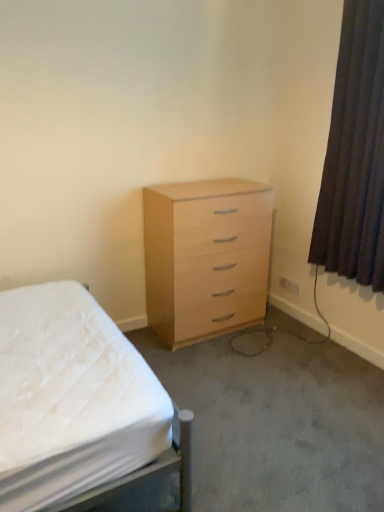
Where is `vacant area in front of light wood/veneer chest of drawers at center`? The height and width of the screenshot is (512, 384). vacant area in front of light wood/veneer chest of drawers at center is located at coordinates click(x=207, y=364).